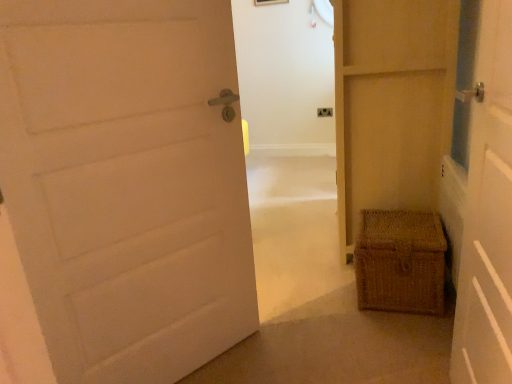
What do you see at coordinates (325, 112) in the screenshot? The width and height of the screenshot is (512, 384). I see `matte plastic electrical outlet at center` at bounding box center [325, 112].

In order to face matte plastic electrical outlet at center, should I rotate leftwards or rightwards?

To align with it, rotate right about 9.214°.

Image resolution: width=512 pixels, height=384 pixels. I want to click on matte beige door at center, which is the 1th door from right to left, so click(391, 104).

Find the location of `wooden picture frame at upper center`. wooden picture frame at upper center is located at coordinates (269, 2).

The image size is (512, 384). Describe the element at coordinates (400, 262) in the screenshot. I see `woven brown basket at right` at that location.

Where is `matte plastic electrical outlet at center`? matte plastic electrical outlet at center is located at coordinates (325, 112).

Which object is positioned more to the left, white matte door at left, the 3th door when ordered from right to left, or wooden picture frame at upper center?

white matte door at left, the 3th door when ordered from right to left.

Is the position of white matte door at left, the first door viewed from the left, more distant than that of wooden picture frame at upper center?

No, the depth of white matte door at left, the first door viewed from the left, is less than that of wooden picture frame at upper center.

Is white matte door at left, the first door viewed from the left, aimed at wooden picture frame at upper center?

No, white matte door at left, the first door viewed from the left, is not oriented towards wooden picture frame at upper center.

Which object is thinner, white matte door at left, the first door viewed from the left, or wooden picture frame at upper center?

wooden picture frame at upper center is thinner.

Is white matte door at left, the first door viewed from the left, completely or partially inside white matte door at right, the second door in the left-to-right sequence?

Definitely not — white matte door at left, the first door viewed from the left, is not inside white matte door at right, the second door in the left-to-right sequence.

Does point (465, 279) lie behind point (104, 209)?

Yes, point (465, 279) is behind point (104, 209).

Which of these two, white matte door at right, which ranks as the second door in right-to-left order, or white matte door at left, the 3th door when ordered from right to left, is thinner?

Thinner between the two is white matte door at left, the 3th door when ordered from right to left.

Are white matte door at right, the second door in the left-to-right sequence, and white matte door at left, the 3th door when ordered from right to left, beside each other?

No, white matte door at right, the second door in the left-to-right sequence, is not beside white matte door at left, the 3th door when ordered from right to left.

Is the depth of wooden picture frame at upper center less than that of matte beige door at center, the third door when ordered from left to right?

No, wooden picture frame at upper center is behind matte beige door at center, the third door when ordered from left to right.

In terms of height, does wooden picture frame at upper center look taller or shorter compared to matte beige door at center, which is the 1th door from right to left?

Clearly, wooden picture frame at upper center is shorter compared to matte beige door at center, which is the 1th door from right to left.

Based on the photo, is the surface of wooden picture frame at upper center in direct contact with matte beige door at center, which is the 1th door from right to left?

No, wooden picture frame at upper center is not making contact with matte beige door at center, which is the 1th door from right to left.

Would you say wooden picture frame at upper center is inside or outside matte beige door at center, which is the 1th door from right to left?

wooden picture frame at upper center exists outside the volume of matte beige door at center, which is the 1th door from right to left.

Is white matte door at right, which ranks as the second door in right-to-left order, spatially inside matte plastic electrical outlet at center, or outside of it?

white matte door at right, which ranks as the second door in right-to-left order, is not inside matte plastic electrical outlet at center, it's outside.

Is white matte door at right, which ranks as the second door in right-to-left order, bigger than matte plastic electrical outlet at center?

Yes, white matte door at right, which ranks as the second door in right-to-left order, is bigger than matte plastic electrical outlet at center.

What's the angular difference between white matte door at right, the second door in the left-to-right sequence, and matte plastic electrical outlet at center's facing directions?

They differ by 92.1 degrees in their facing directions.

From the image's perspective, is white matte door at right, which ranks as the second door in right-to-left order, above or below matte plastic electrical outlet at center?

From the image's perspective, white matte door at right, which ranks as the second door in right-to-left order, appears below matte plastic electrical outlet at center.

Is matte plastic electrical outlet at center positioned behind wooden picture frame at upper center?

Yes, matte plastic electrical outlet at center is further from the camera.

Could you tell me if matte plastic electrical outlet at center is facing wooden picture frame at upper center?

No, matte plastic electrical outlet at center does not turn towards wooden picture frame at upper center.

Locate an element on the screen. The image size is (512, 384). electric outlet that is under the wooden picture frame at upper center (from a real-world perspective) is located at coordinates (325, 112).

From the image's perspective, which one is positioned higher, matte plastic electrical outlet at center or wooden picture frame at upper center?

wooden picture frame at upper center.

Consider the image. Is matte plastic electrical outlet at center looking in the opposite direction of white matte door at right, the second door in the left-to-right sequence?

No, matte plastic electrical outlet at center is not facing away from white matte door at right, the second door in the left-to-right sequence.

Is matte plastic electrical outlet at center completely or partially outside of white matte door at right, which ranks as the second door in right-to-left order?

matte plastic electrical outlet at center is positioned outside white matte door at right, which ranks as the second door in right-to-left order.

Are matte plastic electrical outlet at center and white matte door at right, which ranks as the second door in right-to-left order, located far from each other?

Absolutely, matte plastic electrical outlet at center is distant from white matte door at right, which ranks as the second door in right-to-left order.

Does white matte door at right, which ranks as the second door in right-to-left order, appear on the right side of wooden picture frame at upper center?

Indeed, white matte door at right, which ranks as the second door in right-to-left order, is positioned on the right side of wooden picture frame at upper center.

From the image's perspective, which is above, white matte door at right, the second door in the left-to-right sequence, or wooden picture frame at upper center?

wooden picture frame at upper center is shown above in the image.

Can you tell me how much white matte door at right, the second door in the left-to-right sequence, and wooden picture frame at upper center differ in facing direction?

91.3 degrees.

Find the location of a particular element. picture frame lying on the left of white matte door at right, which ranks as the second door in right-to-left order is located at coordinates (269, 2).

From the image's perspective, which door is the 2nd one below the wooden picture frame at upper center? Please provide its 2D coordinates.

[(126, 184)]

What are the coordinates of `the 1st door counting from the right side of the white matte door at left, the first door viewed from the left` in the screenshot? It's located at (487, 214).

Looking at the image, which one is located further to matte beige door at center, which is the 1th door from right to left, woven brown basket at right or wooden picture frame at upper center?

wooden picture frame at upper center lies further to matte beige door at center, which is the 1th door from right to left, than the other object.

Based on their spatial positions, is woven brown basket at right or matte plastic electrical outlet at center closer to white matte door at right, the second door in the left-to-right sequence?

woven brown basket at right.

Which object lies further to the anchor point matte beige door at center, the third door when ordered from left to right, white matte door at left, the first door viewed from the left, or wooden picture frame at upper center?

wooden picture frame at upper center.

Based on their spatial positions, is white matte door at right, the second door in the left-to-right sequence, or wooden picture frame at upper center closer to woven brown basket at right?

The object closer to woven brown basket at right is white matte door at right, the second door in the left-to-right sequence.

Looking at the image, which one is located closer to wooden picture frame at upper center, white matte door at right, which ranks as the second door in right-to-left order, or matte plastic electrical outlet at center?

The object closer to wooden picture frame at upper center is matte plastic electrical outlet at center.

Considering their positions, is matte plastic electrical outlet at center positioned further to wooden picture frame at upper center than matte beige door at center, which is the 1th door from right to left?

matte beige door at center, which is the 1th door from right to left, is positioned further to the anchor wooden picture frame at upper center.

When comparing their distances from woven brown basket at right, does matte plastic electrical outlet at center or white matte door at left, the first door viewed from the left, seem closer?

white matte door at left, the first door viewed from the left, is closer to woven brown basket at right.

Which object lies further to the anchor point white matte door at right, the second door in the left-to-right sequence, wooden picture frame at upper center or woven brown basket at right?

wooden picture frame at upper center lies further to white matte door at right, the second door in the left-to-right sequence, than the other object.

Identify the location of picture frame between white matte door at left, the 3th door when ordered from right to left, and matte plastic electrical outlet at center from front to back. (269, 2).

Where is `crate between white matte door at left, the first door viewed from the left, and matte plastic electrical outlet at center from front to back`? The height and width of the screenshot is (384, 512). crate between white matte door at left, the first door viewed from the left, and matte plastic electrical outlet at center from front to back is located at coordinates (400, 262).

What are the coordinates of `crate located between white matte door at left, the first door viewed from the left, and wooden picture frame at upper center in the depth direction` in the screenshot? It's located at (400, 262).

The image size is (512, 384). Find the location of `picture frame between white matte door at right, the second door in the left-to-right sequence, and matte plastic electrical outlet at center, along the z-axis`. picture frame between white matte door at right, the second door in the left-to-right sequence, and matte plastic electrical outlet at center, along the z-axis is located at coordinates (269, 2).